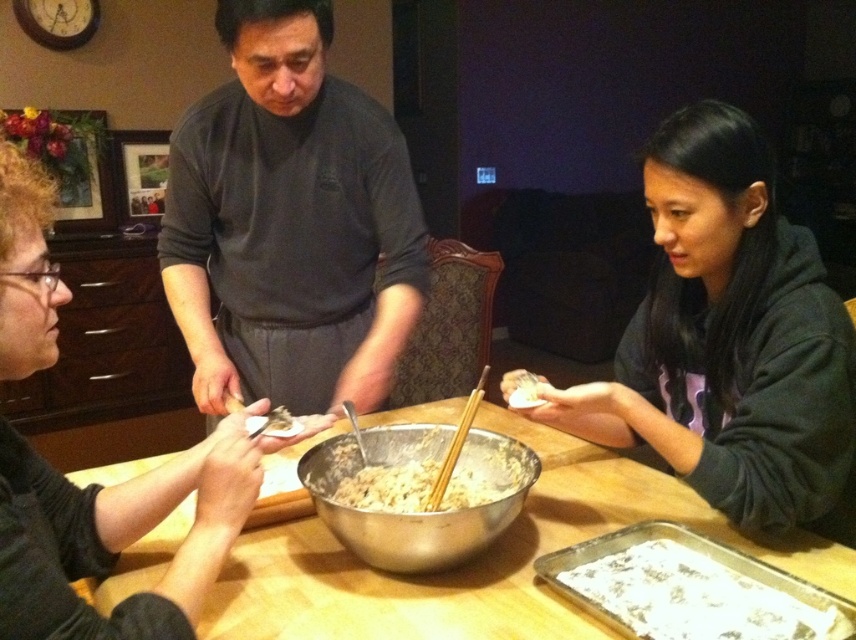
Which is in front, point (798, 481) or point (203, 458)?

Positioned in front is point (203, 458).

Does black hoodie at center appear on the left side of curly hair person at left?

In fact, black hoodie at center is to the right of curly hair person at left.

Measure the distance between point (666,237) and camera.

The distance of point (666,237) from camera is 3.70 feet.

Locate an element on the screen. black hoodie at center is located at coordinates (730, 340).

Which of these two, black hoodie at center or brown wooden chopsticks at center, stands shorter?

With less height is brown wooden chopsticks at center.

Between point (637, 408) and point (438, 502), which one is positioned behind?

Positioned behind is point (637, 408).

Who is more distant from viewer, (846, 538) or (480, 387)?

The point (846, 538) is more distant.

At what (x,y) coordinates should I click in order to perform the action: click on black hoodie at center. Please return your answer as a coordinate pair (x, y). Looking at the image, I should click on (730, 340).

Based on the photo, is the position of wooden table at center less distant than that of metallic silver bowl at center?

Yes, it is in front of metallic silver bowl at center.

Does wooden table at center appear on the left side of metallic silver bowl at center?

In fact, wooden table at center is to the right of metallic silver bowl at center.

What do you see at coordinates (471, 560) in the screenshot?
I see `wooden table at center` at bounding box center [471, 560].

Find the location of a particular element. wooden table at center is located at coordinates (471, 560).